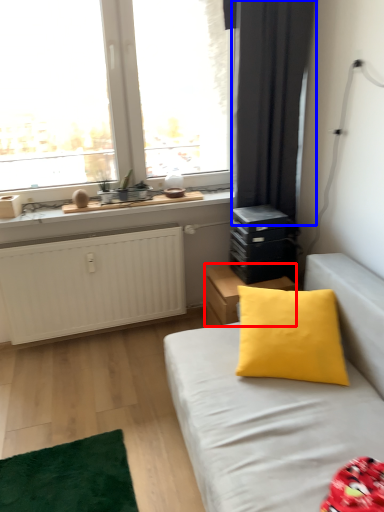
Question: Which object is further to the camera taking this photo, nightstand (highlighted by a red box) or curtain (highlighted by a blue box)?

Choices:
 (A) nightstand
 (B) curtain

Answer: (A)